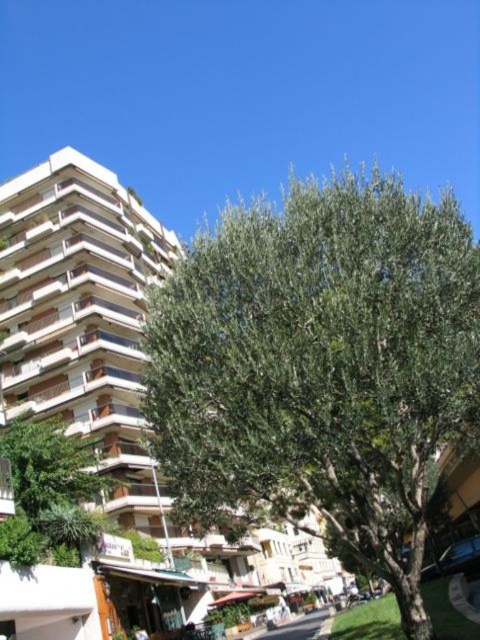
Based on the photo, which of these two, green leafy tree at center or white textured building at center, stands taller?

With more height is green leafy tree at center.

Does green leafy tree at center have a smaller size compared to white textured building at center?

No.

You are a GUI agent. You are given a task and a screenshot of the screen. Output one action in this format:
    pyautogui.click(x=<x>, y=<y>)
    Task: Click on the green leafy tree at center
    Image resolution: width=480 pixels, height=640 pixels.
    Given the screenshot: What is the action you would take?
    pyautogui.click(x=320, y=369)